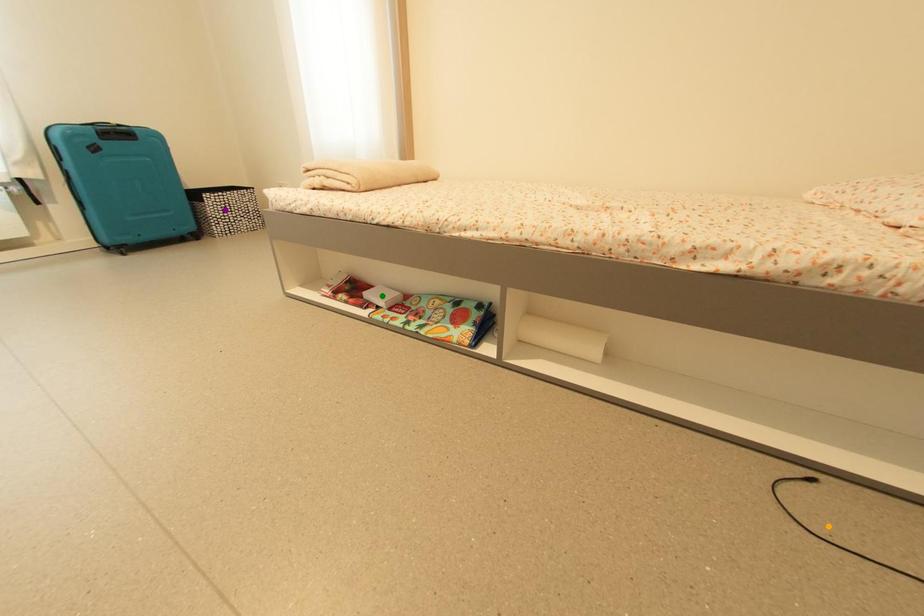
Order these from nearest to farthest:
- orange point
- green point
- purple point

purple point, green point, orange point